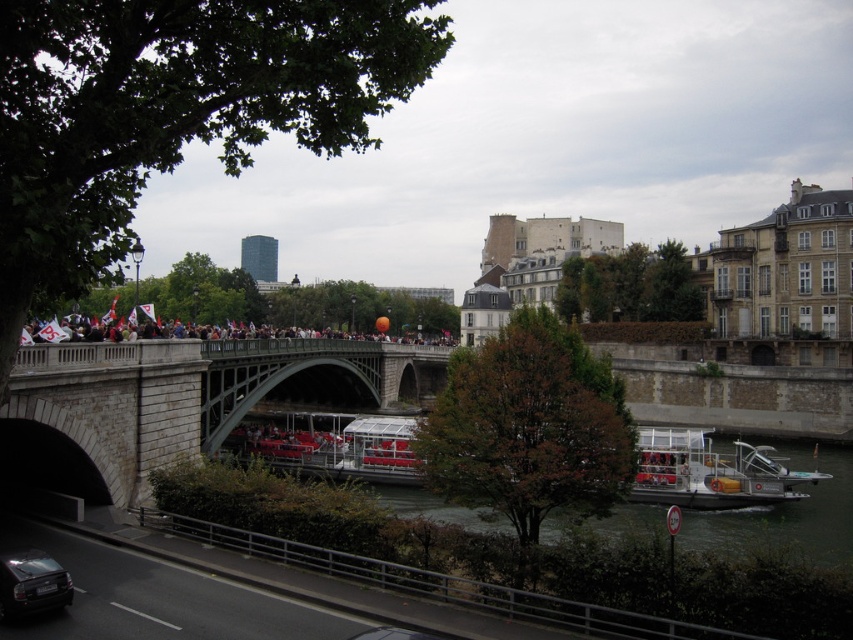
In the scene shown: You are standing at the viewpoint of the image and want to place a small flag at both point (x=165, y=348) and point (x=759, y=472). Which point will have its flag appear larger in the photo?

The flag placed at point (x=165, y=348) will appear larger in the photo because it is closer to the camera than point (x=759, y=472).

You are a tour guide standing on the ferry boat under the stone bridge at center. You want to point out the shiny black car at lower left to your tourists. Can you see the car from your current position? Please explain your reasoning.

The stone bridge at center and the shiny black car at lower left are 18.59 meters apart. Since the car is on the riverbank and the ferry is under the bridge, the distance allows visibility unless obstructed by the bridge structure or other objects. Assuming no obstructions, yes, the car can be seen from the ferry.

You are a tourist standing on the riverbank and want to take a photo of the stone bridge at center and the shiny black car at lower left. Which object is closer to you, the tourist?

The shiny black car at lower left is closer to you since it is positioned to the left of the stone bridge at center, which is further away on the right side.